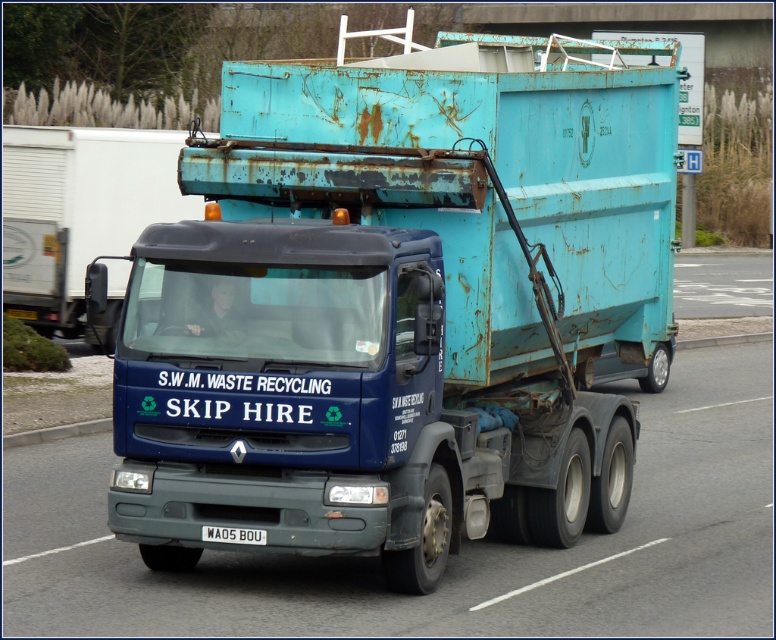
Which is more to the left, blue metallic skip at center or white plastic license plate at center?

blue metallic skip at center

Consider the image. Is the position of blue metallic skip at center more distant than that of white plastic license plate at center?

Yes.

Identify the location of blue metallic skip at center. Image resolution: width=776 pixels, height=640 pixels. (78, 212).

Locate an element on the screen. The image size is (776, 640). blue metallic skip at center is located at coordinates (78, 212).

Who is shorter, rusty metal skip at center or white plastic license plate at center?

white plastic license plate at center

Is point (407, 86) farther from viewer compared to point (203, 536)?

That is True.

Is point (172, 257) farther from viewer compared to point (203, 529)?

Yes.

The image size is (776, 640). What are the coordinates of `rusty metal skip at center` in the screenshot? It's located at point(400,305).

In the scene shown: Who is positioned more to the left, rusty metal skip at center or blue metallic skip at center?

blue metallic skip at center

The image size is (776, 640). What do you see at coordinates (400, 305) in the screenshot?
I see `rusty metal skip at center` at bounding box center [400, 305].

Does point (594, 42) lie in front of point (61, 161)?

That is True.

You are a GUI agent. You are given a task and a screenshot of the screen. Output one action in this format:
    pyautogui.click(x=<x>, y=<y>)
    Task: Click on the rusty metal skip at center
    This screenshot has width=776, height=640.
    Given the screenshot: What is the action you would take?
    pyautogui.click(x=400, y=305)